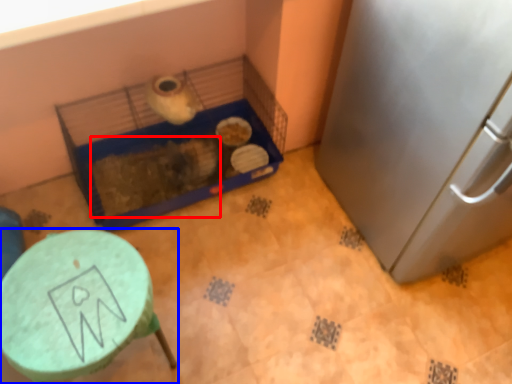
Question: Among these objects, which one is farthest to the camera, animal (highlighted by a red box) or furniture (highlighted by a blue box)?

Choices:
 (A) animal
 (B) furniture

Answer: (A)